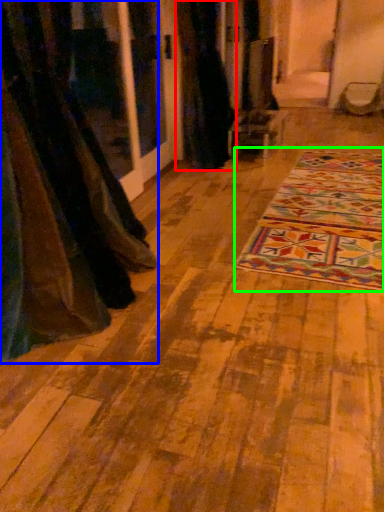
Question: Which object is the closest to the curtain (highlighted by a red box)? Choose among these: curtain (highlighted by a blue box) or mat (highlighted by a green box).

Choices:
 (A) curtain
 (B) mat

Answer: (B)